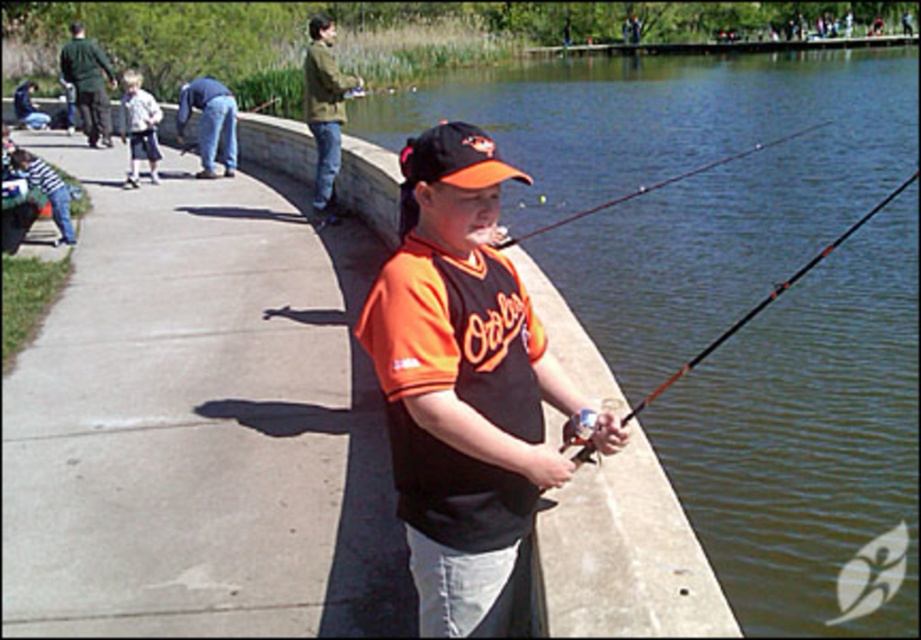
Question: In this image, where is orange fabric baseball cap at center located relative to light blue shorts at left?

Choices:
 (A) above
 (B) below

Answer: (A)

Question: Which point is farther from the camera taking this photo?

Choices:
 (A) (701, 540)
 (B) (467, 132)
 (C) (453, 509)

Answer: (A)

Question: Considering the relative positions of green water at fishing rod right and light blue shorts at left in the image provided, where is green water at fishing rod right located with respect to light blue shorts at left?

Choices:
 (A) below
 (B) above

Answer: (B)

Question: Which of the following is the closest to the observer?

Choices:
 (A) (660, 387)
 (B) (438, 154)
 (C) (819, 241)

Answer: (B)

Question: Which object appears closest to the camera in this image?

Choices:
 (A) green water at fishing rod right
 (B) orange fabric baseball cap at center

Answer: (B)

Question: Where is orange fabric baseball cap at center located in relation to orange matte fishing rod at center in the image?

Choices:
 (A) left
 (B) right

Answer: (A)